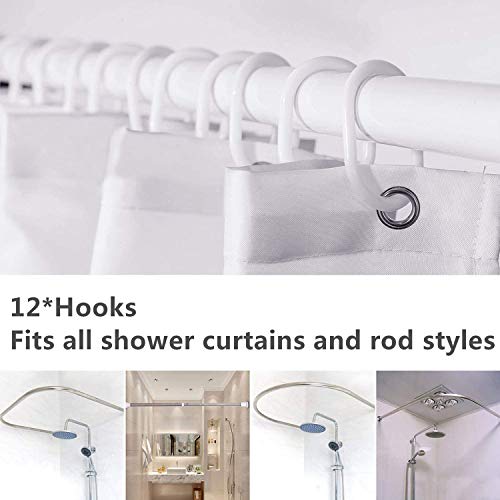
This screenshot has width=500, height=500. Identify the location of hook. (131, 95).